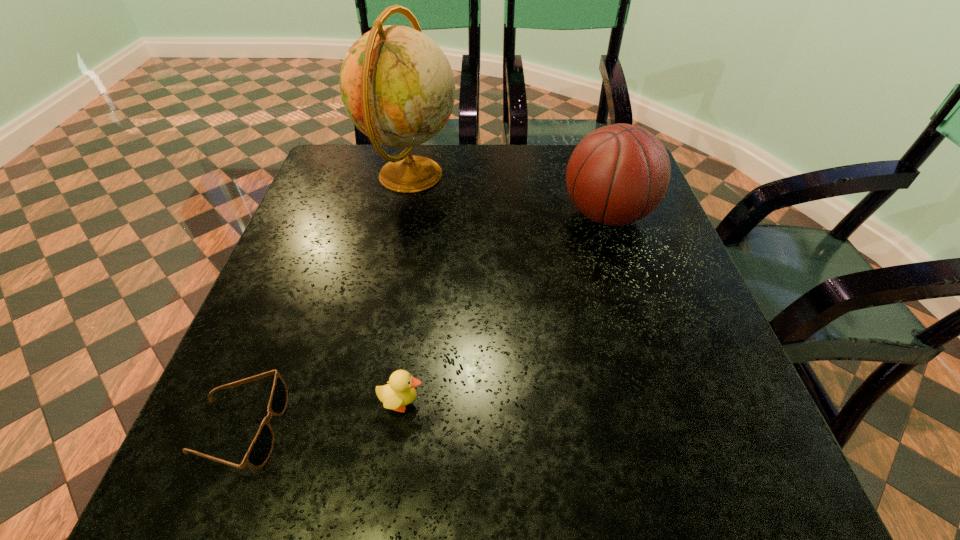
Where is `free spot at the left edge of the desktop`? This screenshot has width=960, height=540. free spot at the left edge of the desktop is located at coordinates (223, 415).

In the image, there is a desktop. Identify the location of vacant space at the right edge. (719, 421).

In the image, there is a desktop. Where is `vacant area at the far left corner`? This screenshot has height=540, width=960. vacant area at the far left corner is located at coordinates coord(370,177).

Where is `free area in between the duckling and the shortest object`? free area in between the duckling and the shortest object is located at coordinates (321, 415).

Where is `free space between the second tallest object and the shortest object`? This screenshot has height=540, width=960. free space between the second tallest object and the shortest object is located at coordinates (423, 321).

I want to click on empty location between the shortest object and the duckling, so (321, 415).

At what (x,y) coordinates should I click in order to perform the action: click on free space between the tallest object and the rightmost object. Please return your answer as a coordinate pair (x, y). This screenshot has width=960, height=540. Looking at the image, I should click on (509, 195).

I want to click on unoccupied position between the basketball and the sunglasses, so click(423, 321).

What are the coordinates of `vacant space in between the third shortest object and the duckling` in the screenshot? It's located at (504, 309).

Locate an element on the screen. The width and height of the screenshot is (960, 540). vacant space that's between the sunglasses and the rightmost object is located at coordinates (423, 321).